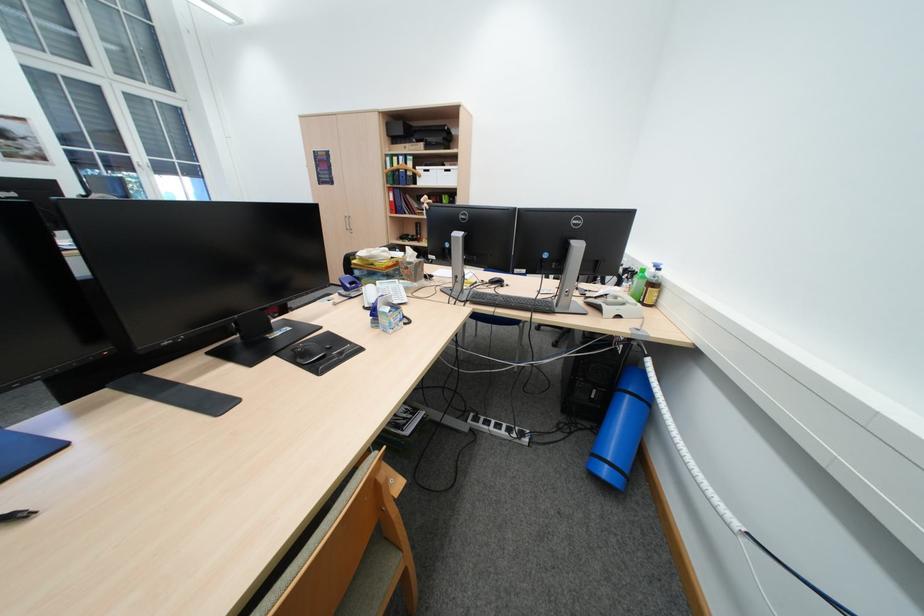
This screenshot has height=616, width=924. I want to click on brown plastic bottle, so click(x=651, y=286).